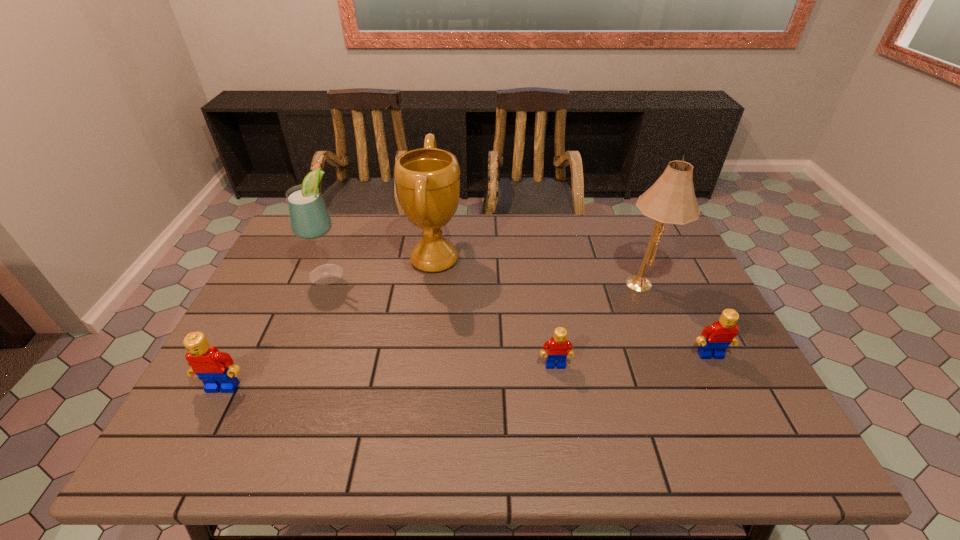
Find the location of a particular element. This screenshot has width=960, height=540. the leftmost Lego is located at coordinates (216, 369).

This screenshot has height=540, width=960. What are the coordinates of `the leftmost object` in the screenshot? It's located at (216, 369).

The width and height of the screenshot is (960, 540). I want to click on the shortest object, so click(556, 349).

You are a GUI agent. You are given a task and a screenshot of the screen. Output one action in this format:
    pyautogui.click(x=<x>, y=<y>)
    Task: Click on the shortest Lego
    
    Given the screenshot: What is the action you would take?
    pyautogui.click(x=556, y=349)

Locate an element on the screen. This screenshot has height=540, width=960. the second tallest Lego is located at coordinates click(x=720, y=334).

The width and height of the screenshot is (960, 540). I want to click on the fifth tallest object, so click(x=720, y=334).

The height and width of the screenshot is (540, 960). Find the location of `lampshade`. lampshade is located at coordinates (671, 199).

The height and width of the screenshot is (540, 960). I want to click on award, so click(x=427, y=180).

Where is `the fifth object from right to left`? This screenshot has width=960, height=540. the fifth object from right to left is located at coordinates (309, 218).

At what (x,y) coordinates should I click in order to perform the action: click on vacant space located on the front-facing side of the leftmost Lego. Please return your answer as a coordinate pair (x, y). The width and height of the screenshot is (960, 540). Looking at the image, I should click on (209, 415).